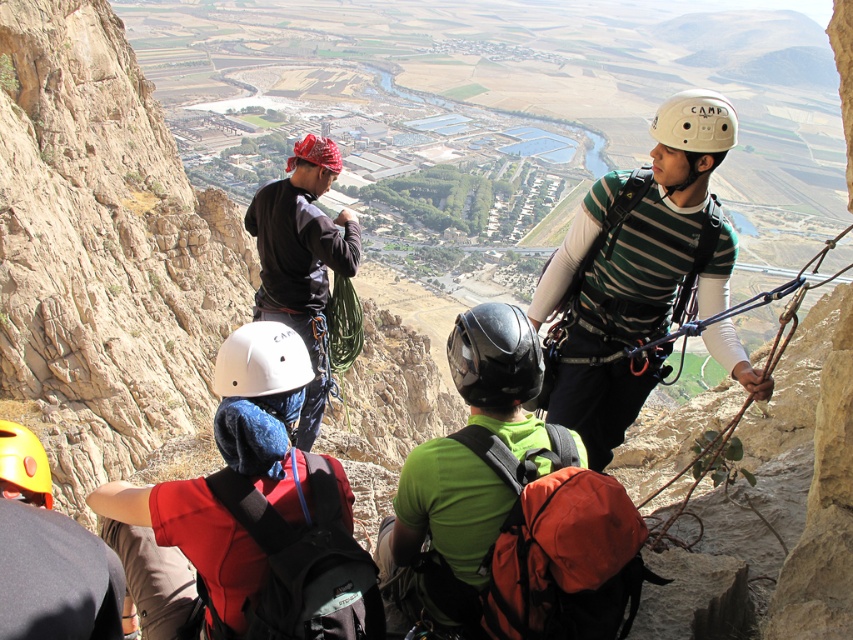
Question: Does green striped shirt at center appear over black matte helmet at center?

Choices:
 (A) no
 (B) yes

Answer: (B)

Question: Can you confirm if black matte helmet at center is positioned below red fabric helmet at center?

Choices:
 (A) yes
 (B) no

Answer: (A)

Question: Which point is closer to the camera taking this photo?

Choices:
 (A) (343, 257)
 (B) (315, 145)
 (C) (236, 384)
 (D) (13, 461)

Answer: (D)

Question: Is dark gray fabric climbing harness at center positioned in front of white matte helmet at center?

Choices:
 (A) no
 (B) yes

Answer: (A)

Question: Which object is farther from the camera taking this photo?

Choices:
 (A) white matte helmet at upper center
 (B) black matte helmet at center

Answer: (A)

Question: Which object is the farthest from the red fabric helmet at center?

Choices:
 (A) white matte helmet at upper center
 (B) dark gray fabric climbing harness at center
 (C) black matte helmet at center
 (D) yellow matte helmet at lower left

Answer: (A)